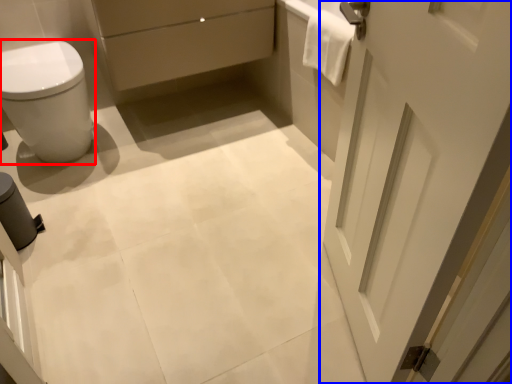
Question: Among these objects, which one is farthest to the camera, bidet (highlighted by a red box) or door (highlighted by a blue box)?

Choices:
 (A) bidet
 (B) door

Answer: (A)